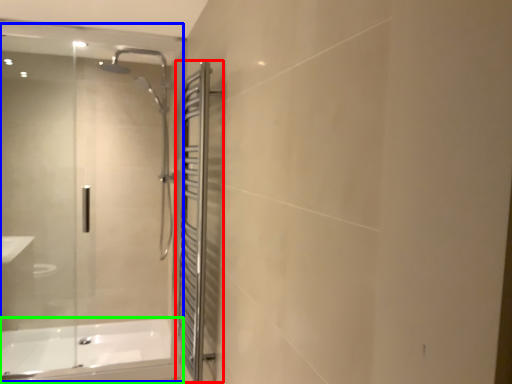
Question: Based on their relative distances, which object is nearer to screen door (highlighted by a red box)? Choose from glass door (highlighted by a blue box) and bathtub (highlighted by a green box).

Choices:
 (A) glass door
 (B) bathtub

Answer: (B)